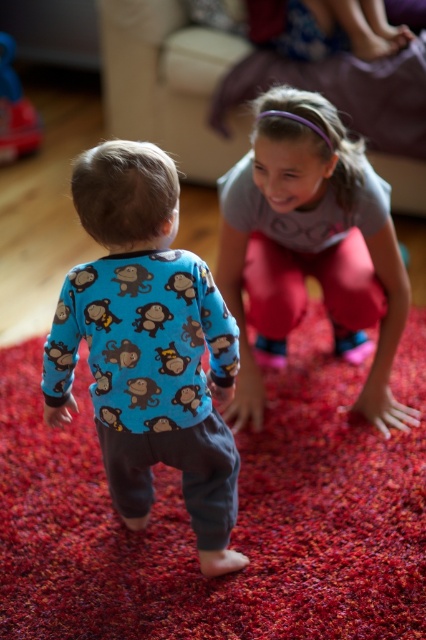
You are a parent in the living room with a 1.8 meter wide toy box that needs to be placed between the matte gray shirt at center and the rubber duck at left. Can the toy box fit in the space between them?

The distance between the matte gray shirt at center and the rubber duck at left is 1.90 meters. Since the toy box is 1.8 meters wide, it can fit in the space between them as the distance is slightly larger than the toy box width.

You are standing in the room and want to reach the point marked as point (80, 161). If you take a step forward of 1 meter, will you be closer to the point?

Yes, because the distance between you and point (80, 161) is 1.36 meters. Taking a 1 meter step forward reduces the distance to 0.36 meters, making you closer.

You are a parent observing two children playing on a red carpet. You notice a matte gray shirt at center and a rubber duck at left. Which object is closer to the left edge of the carpet?

The rubber duck at left is closer to the left edge of the carpet because the matte gray shirt at center is positioned on the right side of it.